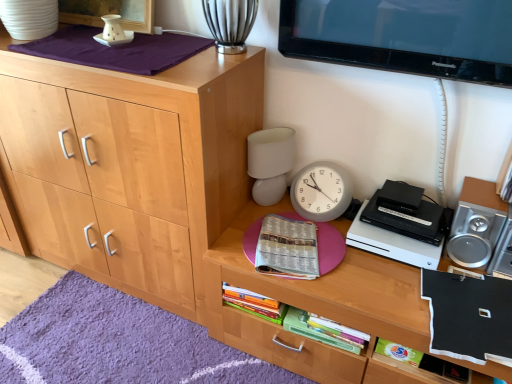
You are a GUI agent. You are given a task and a screenshot of the screen. Output one action in this format:
    pyautogui.click(x=<x>, y=<y>)
    Task: Click on the free spot above natural wood cabinet at left (from a real-world perspective)
    
    Given the screenshot: What is the action you would take?
    pyautogui.click(x=116, y=43)